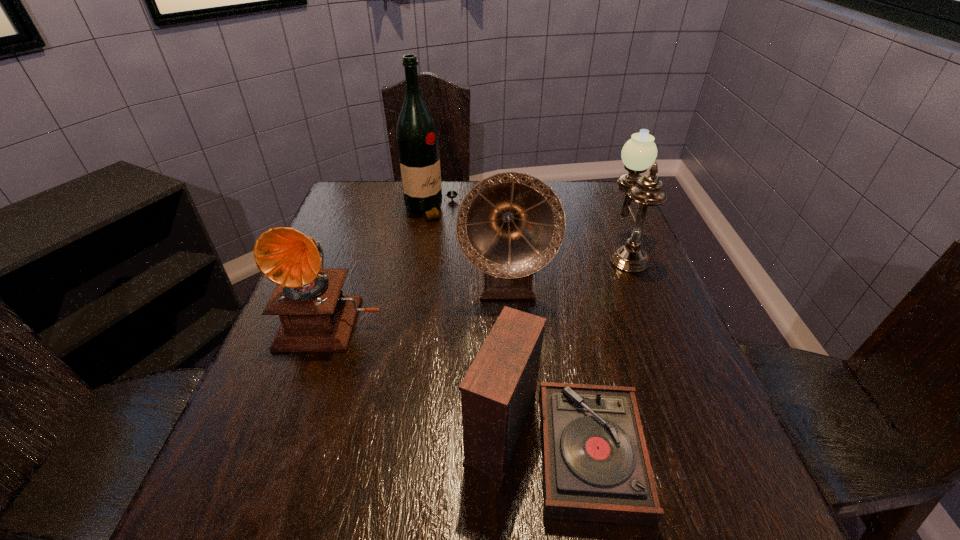
This screenshot has width=960, height=540. In the image, there is a desktop. Find the location of `vacant space at the far right corner`. vacant space at the far right corner is located at coordinates (596, 193).

I want to click on vacant area between the rightmost object and the shortest object, so click(x=588, y=342).

Image resolution: width=960 pixels, height=540 pixels. I want to click on empty space between the tallest object and the leftmost phonograph record, so click(383, 264).

Where is `free space between the nearest object and the leftmost phonograph record`? This screenshot has height=540, width=960. free space between the nearest object and the leftmost phonograph record is located at coordinates (444, 377).

At what (x,y) coordinates should I click in order to perform the action: click on object that is the third closest to the tallest object. Please return your answer as a coordinate pair (x, y). Looking at the image, I should click on (639, 153).

Locate an element on the screen. object that can be found as the closest to the farthest object is located at coordinates (510, 225).

The height and width of the screenshot is (540, 960). Find the location of `phonograph record object that ranks as the second closest to the nearest phonograph record`. phonograph record object that ranks as the second closest to the nearest phonograph record is located at coordinates (315, 316).

At what (x,y) coordinates should I click in order to perform the action: click on phonograph record that is the third nearest to the rightmost object. Please return your answer as a coordinate pair (x, y). Image resolution: width=960 pixels, height=540 pixels. Looking at the image, I should click on (315, 316).

Where is `vacant region that satisfies the following two spatial constraints: 1. on the horn of the leftmost phonograph record; 2. on the left side of the nearest phonograph record`? vacant region that satisfies the following two spatial constraints: 1. on the horn of the leftmost phonograph record; 2. on the left side of the nearest phonograph record is located at coordinates (295, 435).